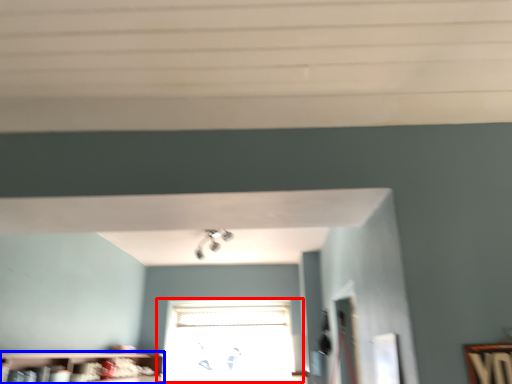
Question: Which of the following is the closest to the observer, window (highlighted by a red box) or shelf (highlighted by a blue box)?

Choices:
 (A) window
 (B) shelf

Answer: (B)